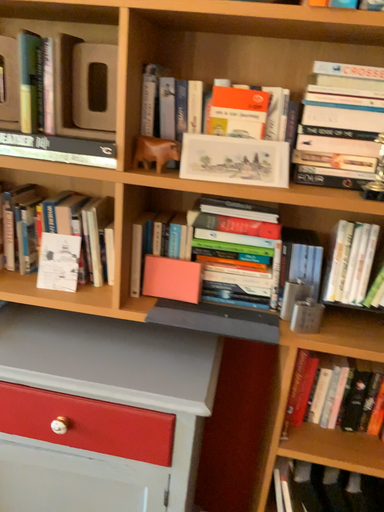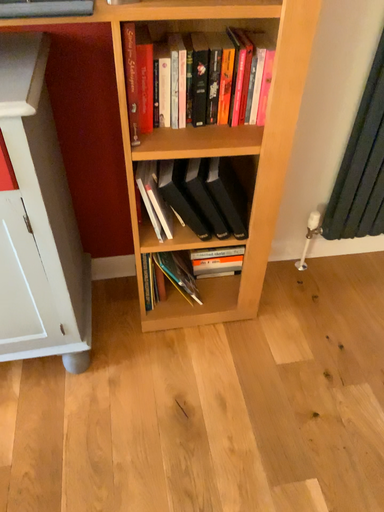
Question: How did the camera likely rotate when shooting the video?

Choices:
 (A) rotated upward
 (B) rotated downward

Answer: (B)